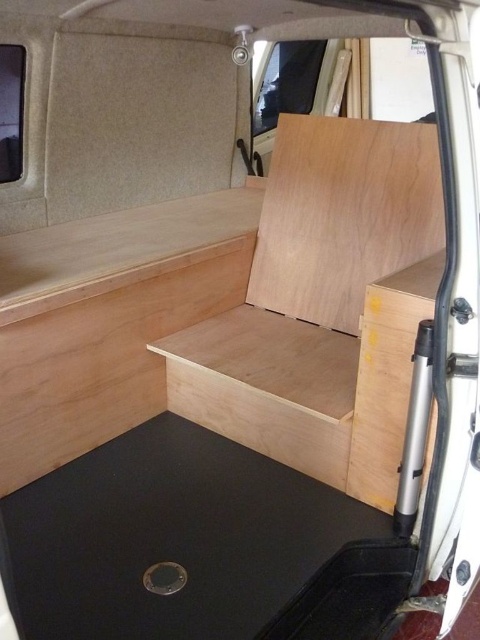
You are planning to place a 1.2 meter wide storage box in the van. The black rubber mat at lower left and natural wood plywood at center are in the way. Which object should you move to make space?

The black rubber mat at lower left has a greater width than the natural wood plywood at center, so you should move the black rubber mat at lower left to make more space for the storage box.

You are inside the converted van and need to place a heavy tool box. The natural wood plywood at lower left and the natural wood plywood at center are both potential spots. Which surface is located underneath the other, and why might that matter?

The natural wood plywood at lower left is positioned under the natural wood plywood at center. This means the lower left surface is closer to the floor, so placing the heavy tool box there might be more stable and less likely to obstruct access to the center area.

You are standing inside the converted van and need to place a heavy object on the floor. The black rubber mat at lower left and the natural wood plywood at center are both visible. Which surface should you choose to ensure stability?

The black rubber mat at lower left is located below natural wood plywood at center, so placing the heavy object on the black rubber mat at lower left would provide a stable base since it is positioned lower and likely closer to the ground, offering better support.